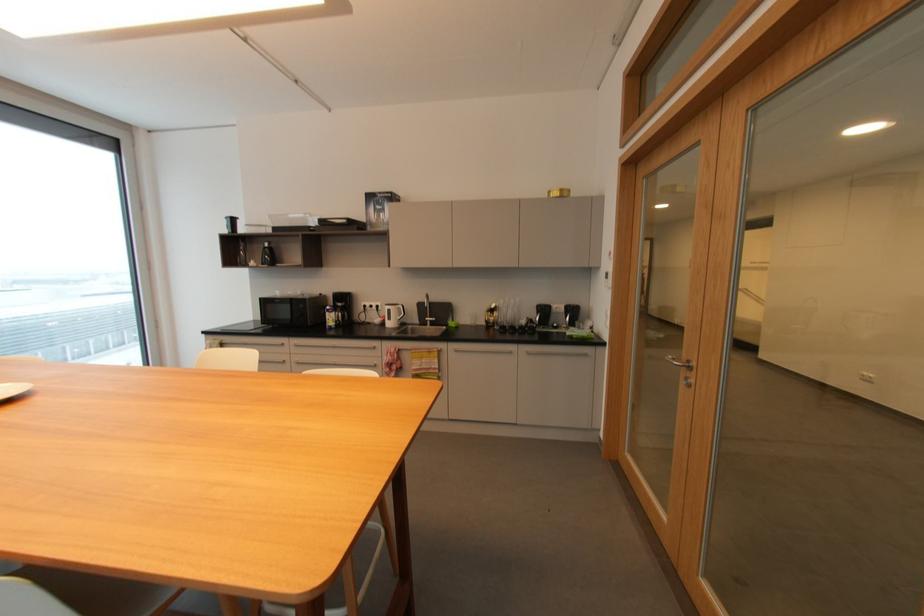
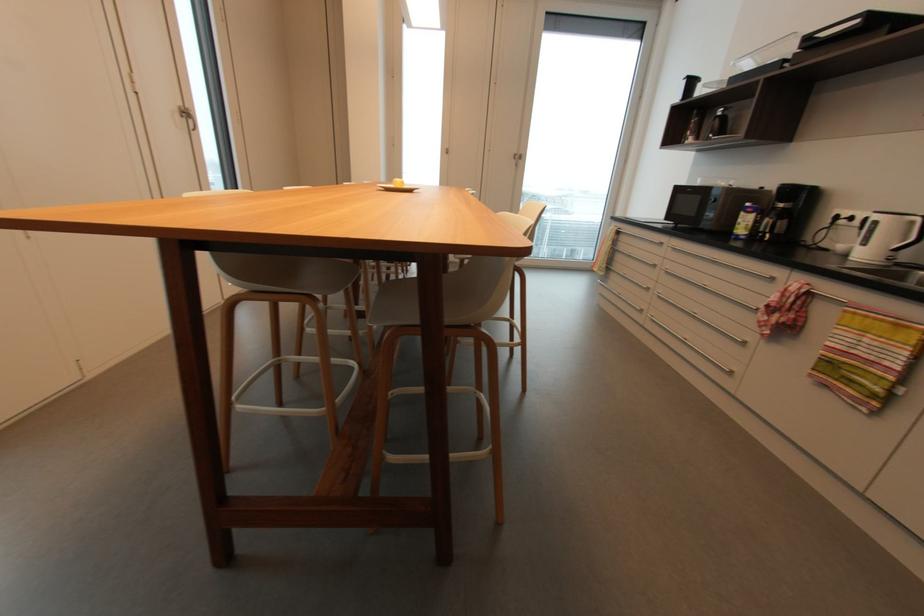
The point at (403, 308) is marked in the first image. Where is the corresponding point in the second image?

(916, 223)